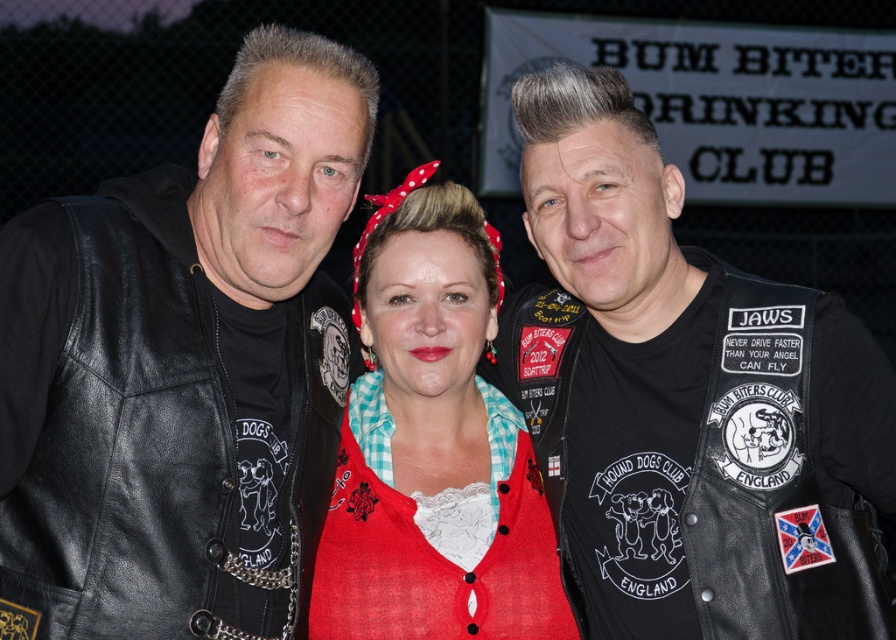
Which of these two, leather vest at center or black leather jacket at left, stands taller?

With more height is leather vest at center.

Between point (696, 250) and point (166, 461), which one is positioned behind?

The point (696, 250) is behind.

Locate an element on the screen. leather vest at center is located at coordinates (683, 396).

Can you confirm if black leather jacket at left is positioned to the right of matte red cardigan at center?

No, black leather jacket at left is not to the right of matte red cardigan at center.

Does black leather jacket at left have a lesser width compared to matte red cardigan at center?

Yes, black leather jacket at left is thinner than matte red cardigan at center.

Which is in front, point (166, 576) or point (483, 326)?

Point (166, 576)

Identify the location of black leather jacket at left. This screenshot has width=896, height=640. [144, 419].

Which is above, leather vest at center or matte red cardigan at center?

→ leather vest at center

Between leather vest at center and matte red cardigan at center, which one has more height?

Standing taller between the two is leather vest at center.

Is point (539, 74) closer to viewer compared to point (515, 561)?

No.

The width and height of the screenshot is (896, 640). Find the location of `leather vest at center`. leather vest at center is located at coordinates (683, 396).